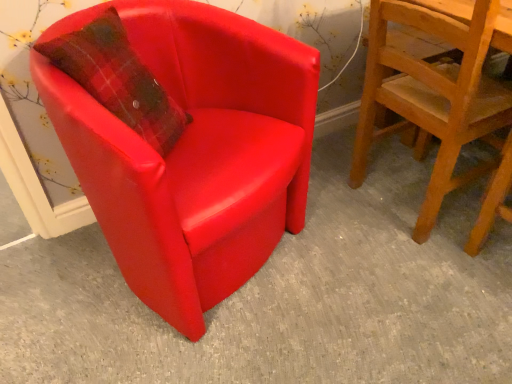
Question: Considering the positions of point (263, 148) and point (490, 92), is point (263, 148) closer or farther from the camera than point (490, 92)?

Choices:
 (A) farther
 (B) closer

Answer: (B)

Question: Is matte red armchair at left, which ranks as the 1th chair in left-to-right order, to the left or to the right of wooden textured chair at right, the second chair from the left, in the image?

Choices:
 (A) right
 (B) left

Answer: (B)

Question: Looking at their shapes, would you say matte red armchair at left, the second chair positioned from the right, is wider or thinner than wooden textured chair at right, the first chair in the right-to-left sequence?

Choices:
 (A) wide
 (B) thin

Answer: (A)

Question: From a real-world perspective, relative to matte red armchair at left, the second chair positioned from the right, is wooden textured chair at right, the second chair from the left, vertically above or below?

Choices:
 (A) below
 (B) above

Answer: (B)

Question: Looking at their shapes, would you say wooden textured chair at right, the second chair from the left, is wider or thinner than matte red armchair at left, the second chair positioned from the right?

Choices:
 (A) thin
 (B) wide

Answer: (A)

Question: Considering the positions of wooden textured chair at right, the second chair from the left, and matte red armchair at left, the second chair positioned from the right, in the image, is wooden textured chair at right, the second chair from the left, bigger or smaller than matte red armchair at left, the second chair positioned from the right,?

Choices:
 (A) big
 (B) small

Answer: (B)

Question: Is wooden textured chair at right, the second chair from the left, to the left or to the right of matte red armchair at left, the second chair positioned from the right, in the image?

Choices:
 (A) right
 (B) left

Answer: (A)